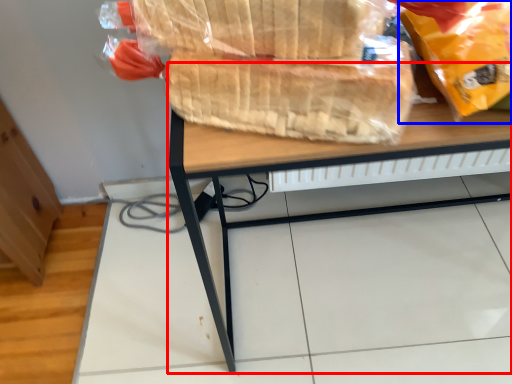
Question: Which point is closer to the camera, desk (highlighted by a red box) or plastic bag (highlighted by a blue box)?

Choices:
 (A) desk
 (B) plastic bag

Answer: (B)